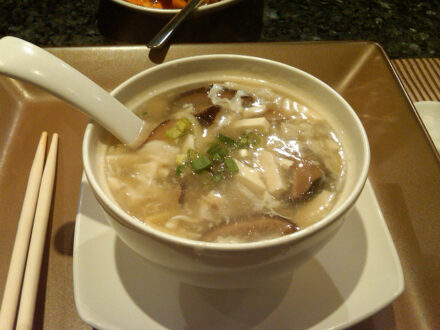
Image resolution: width=440 pixels, height=330 pixels. Find the location of `ramen type bowl`. ramen type bowl is located at coordinates (274, 265).